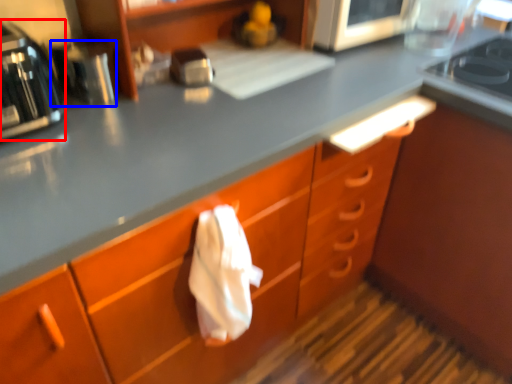
Question: Which object appears closest to the camera in this image, home appliance (highlighted by a red box) or appliance (highlighted by a blue box)?

Choices:
 (A) home appliance
 (B) appliance

Answer: (A)